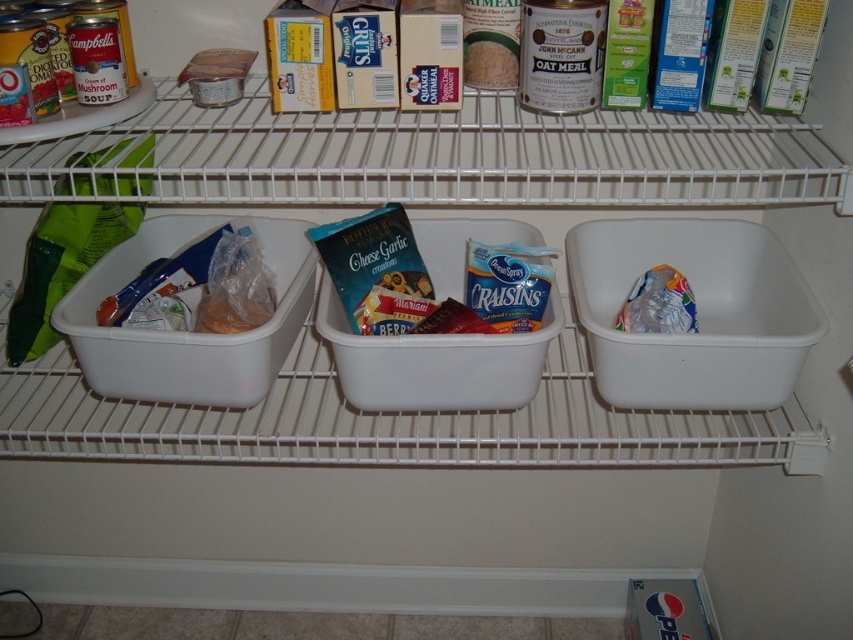
Question: Is translucent plastic bag at center right below smooth white rice at center?

Choices:
 (A) yes
 (B) no

Answer: (A)

Question: Does translucent plastic bag at center right have a greater width compared to smooth white rice at center?

Choices:
 (A) yes
 (B) no

Answer: (A)

Question: Where is translucent plastic bag at center right located in relation to smooth white rice at center in the image?

Choices:
 (A) right
 (B) left

Answer: (A)

Question: Among these objects, which one is farthest from the camera?

Choices:
 (A) smooth white rice at center
 (B) translucent plastic bag at center right

Answer: (B)